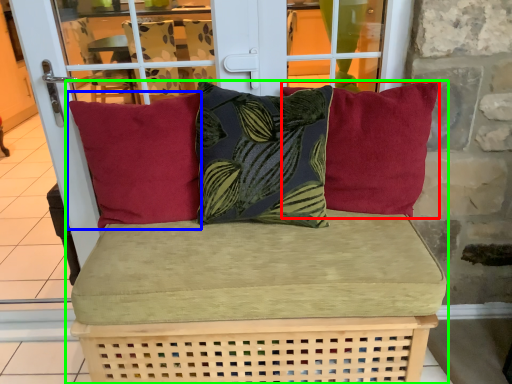
Question: Which object is positioned farthest from pillow (highlighted by a red box)? Select from pillow (highlighted by a blue box) and studio couch (highlighted by a green box).

Choices:
 (A) pillow
 (B) studio couch

Answer: (A)